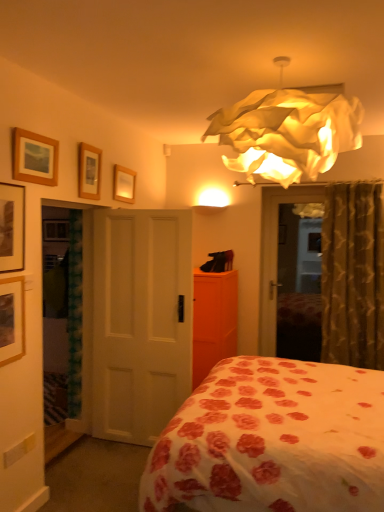
Question: Looking at the image, does wooden picture frame at upper center, which is counted as the first picture frame, starting from the back, seem bigger or smaller compared to matte black picture frame at upper left, marked as the fourth picture frame in a right-to-left arrangement?

Choices:
 (A) small
 (B) big

Answer: (A)

Question: From the image's perspective, is wooden picture frame at upper center, which is counted as the first picture frame, starting from the back, positioned above or below matte black picture frame at upper left, positioned as the 4th picture frame in back-to-front order?

Choices:
 (A) above
 (B) below

Answer: (A)

Question: Estimate the real-world distances between objects in this image. Which object is farther from the orange matte dresser at center?

Choices:
 (A) wooden picture frame at upper center, the first picture frame positioned from the right
 (B) wooden picture frame at left, arranged as the 1th picture frame when viewed from the left
 (C) wooden framed picture at upper left, which ranks as the third picture frame in front-to-back order
 (D) white matte door at center
 (E) matte black picture frame at upper left, which appears as the second picture frame when viewed from the left

Answer: (E)

Question: Considering the real-world distances, which object is closest to the wooden picture frame at upper center, placed as the fifth picture frame when sorted from front to back?

Choices:
 (A) wooden picture frame at upper center, the second picture frame when ordered from back to front
 (B) orange matte dresser at center
 (C) white floral fabric bed at center
 (D) white matte door at center
 (E) wooden framed picture at upper left, which is the 3th picture frame from right to left

Answer: (A)